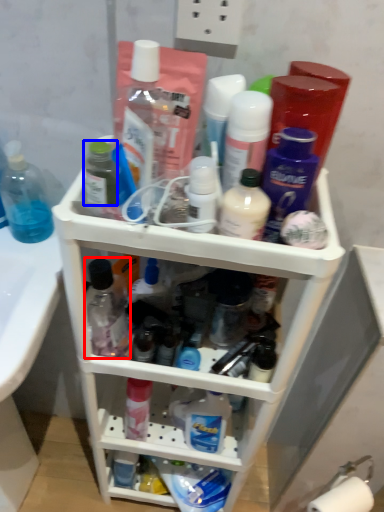
Question: Which object appears closest to the camera in this image, toiletry (highlighted by a red box) or toiletry (highlighted by a blue box)?

Choices:
 (A) toiletry
 (B) toiletry

Answer: (B)